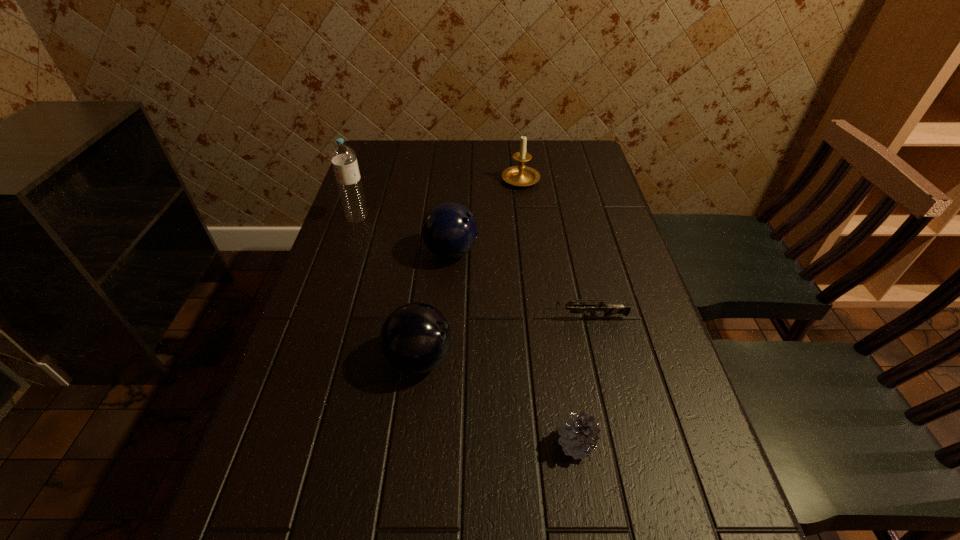
At what (x,y) coordinates should I click in order to perform the action: click on the leftmost object. Please return your answer as a coordinate pair (x, y). The height and width of the screenshot is (540, 960). Looking at the image, I should click on (343, 157).

Where is `the second farthest object`? the second farthest object is located at coordinates (343, 157).

Where is `candle holder`? This screenshot has width=960, height=540. candle holder is located at coordinates (521, 175).

Where is `the fourth nearest object`? This screenshot has height=540, width=960. the fourth nearest object is located at coordinates (449, 230).

Where is `the second nearest object`? The width and height of the screenshot is (960, 540). the second nearest object is located at coordinates (415, 338).

Find the location of a particular element. the nearest object is located at coordinates (579, 437).

Locate an element on the screen. This screenshot has height=540, width=960. the fifth tallest object is located at coordinates click(579, 437).

The image size is (960, 540). Find the location of `the third nearest object`. the third nearest object is located at coordinates (609, 309).

This screenshot has width=960, height=540. In order to click on gun in this screenshot , I will do `click(609, 309)`.

Where is `free space located on the front of the water bottle`? This screenshot has height=540, width=960. free space located on the front of the water bottle is located at coordinates (321, 327).